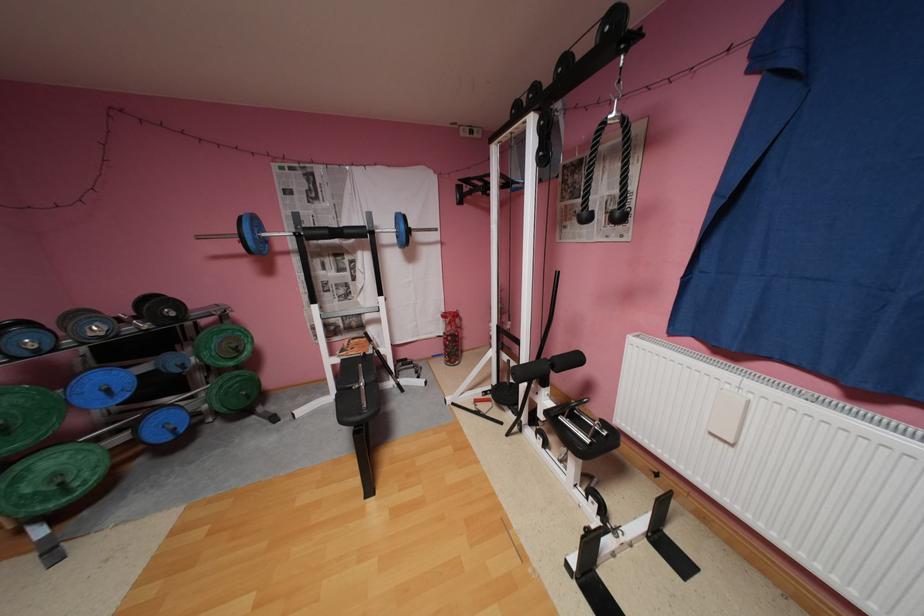
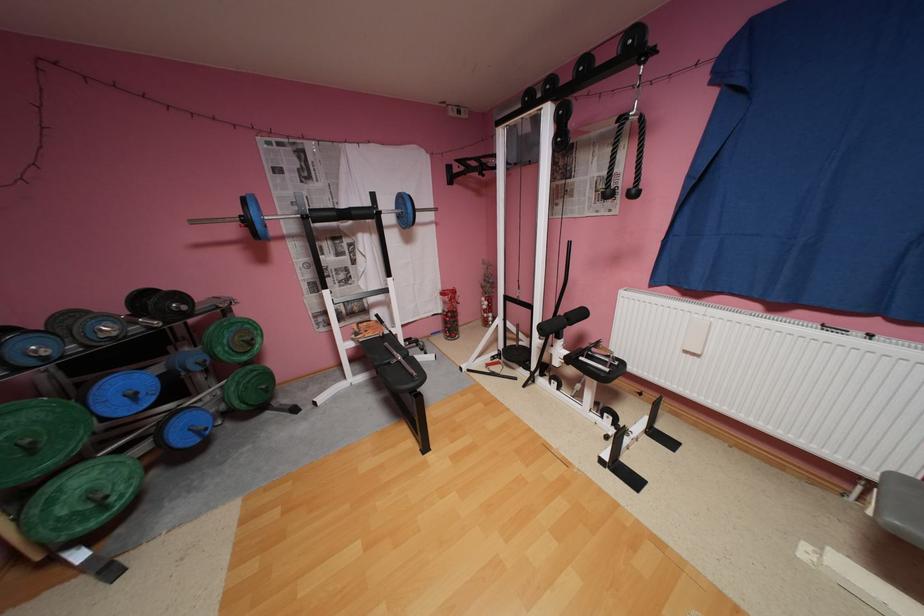
Where in the second image is the point corresponding to (78,492) from the first image?

(116, 508)